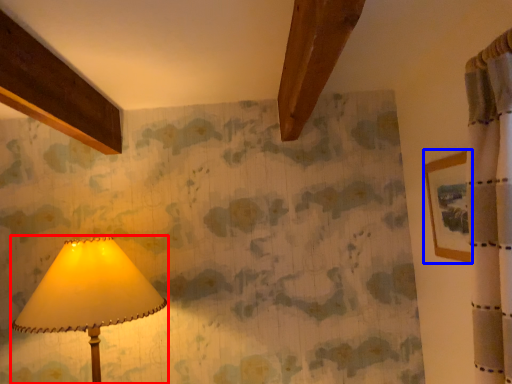
Question: Which point is further to the camera, lamp (highlighted by a red box) or picture frame (highlighted by a blue box)?

Choices:
 (A) lamp
 (B) picture frame

Answer: (A)